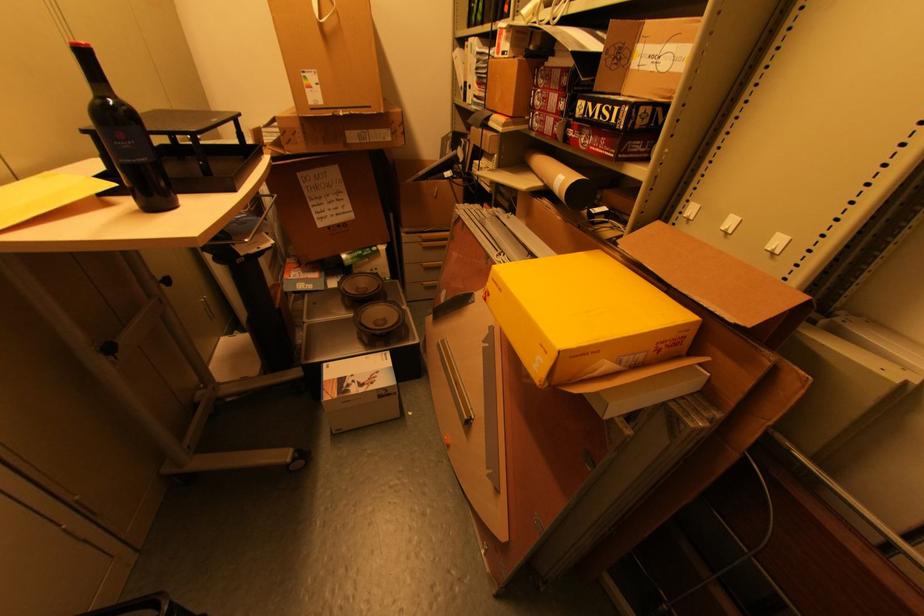
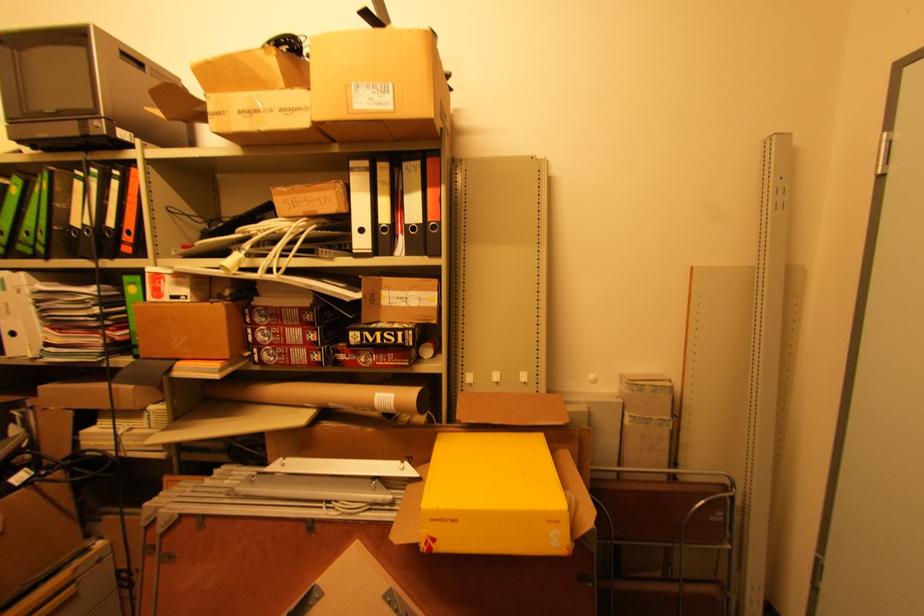
Where in the second image is the point corresponding to [626,62] from the first image?

(380, 302)